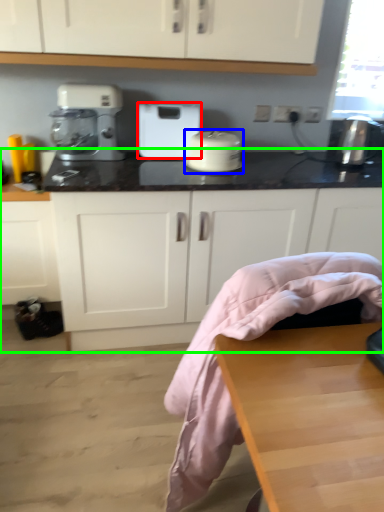
Question: Which is farther away from home appliance (highlighted by a red box)? kitchen appliance (highlighted by a blue box) or countertop (highlighted by a green box)?

Choices:
 (A) kitchen appliance
 (B) countertop

Answer: (B)